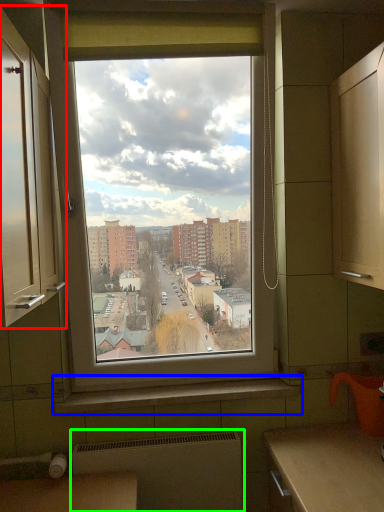
Question: Which is nearer to the cabinetry (highlighted by a red box)? window sill (highlighted by a blue box) or radiator (highlighted by a green box).

Choices:
 (A) window sill
 (B) radiator

Answer: (A)